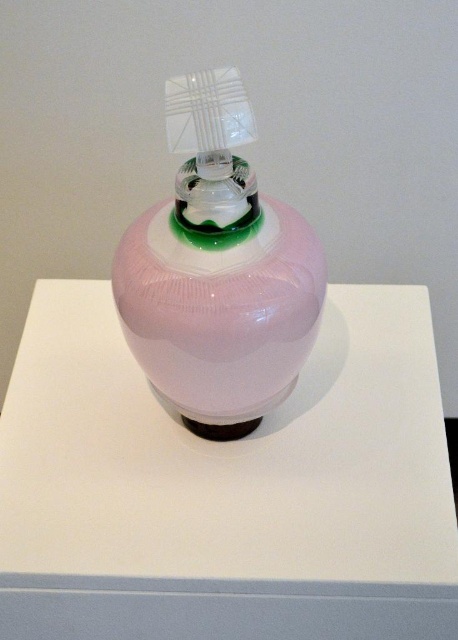
Question: Is glossy white table at center above pink glossy bottle at center?

Choices:
 (A) no
 (B) yes

Answer: (A)

Question: Which point is farther to the camera?

Choices:
 (A) pink glossy bottle at center
 (B) glossy white table at center

Answer: (B)

Question: Among these objects, which one is farthest from the camera?

Choices:
 (A) glossy white table at center
 (B) pink glossy bottle at center

Answer: (A)

Question: Does glossy white table at center lie in front of pink glossy bottle at center?

Choices:
 (A) no
 (B) yes

Answer: (A)

Question: Which of the following is the farthest from the observer?

Choices:
 (A) glossy white table at center
 (B) pink glossy bottle at center

Answer: (A)

Question: From the image, what is the correct spatial relationship of glossy white table at center in relation to pink glossy bottle at center?

Choices:
 (A) above
 (B) below

Answer: (B)